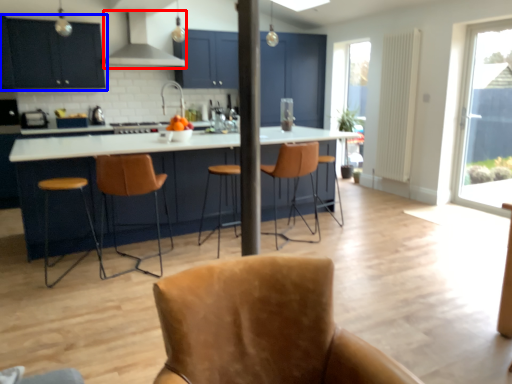
Question: Which point is further to the camera, exhaust hood (highlighted by a red box) or cabinetry (highlighted by a blue box)?

Choices:
 (A) exhaust hood
 (B) cabinetry

Answer: (A)